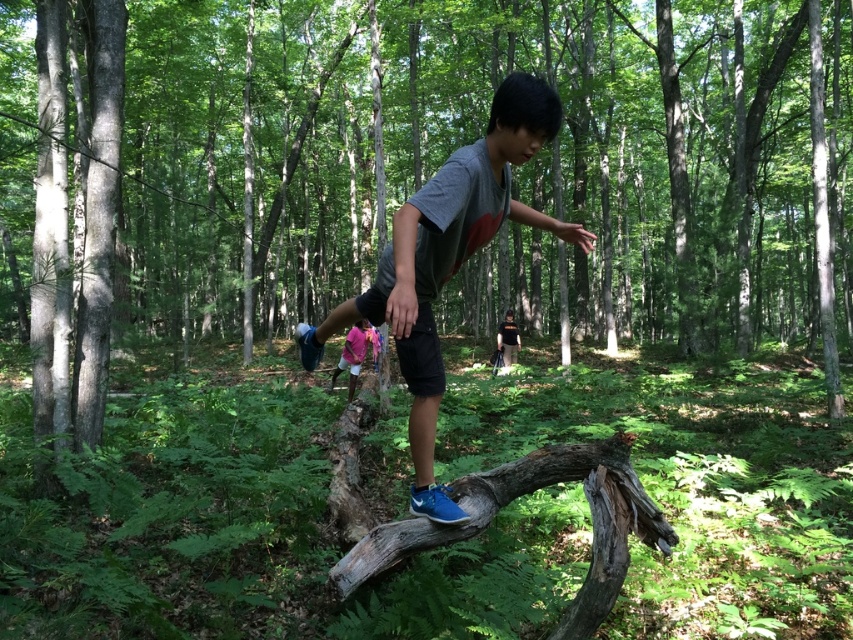
Question: Which object appears closest to the camera in this image?

Choices:
 (A) pink fabric shorts at center
 (B) black matte shirt at center
 (C) gray cotton t-shirt at center

Answer: (C)

Question: Does pink fabric shorts at center have a greater width compared to black matte shirt at center?

Choices:
 (A) no
 (B) yes

Answer: (B)

Question: Is gray cotton t-shirt at center smaller than black matte shirt at center?

Choices:
 (A) no
 (B) yes

Answer: (A)

Question: Does pink fabric shorts at center have a greater width compared to black matte shirt at center?

Choices:
 (A) yes
 (B) no

Answer: (A)

Question: Among these points, which one is farthest from the camera?

Choices:
 (A) (500, 326)
 (B) (332, 380)

Answer: (A)

Question: Which of the following is the farthest from the observer?

Choices:
 (A) black matte shirt at center
 (B) gray cotton t-shirt at center

Answer: (A)